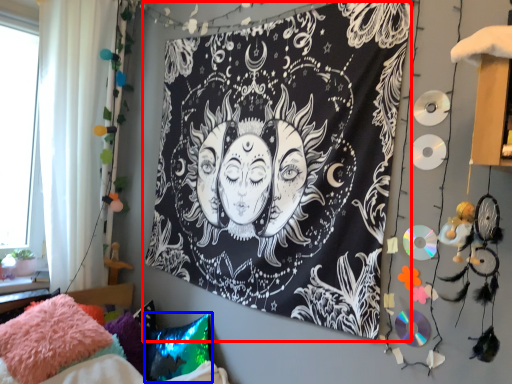
Question: Among these objects, which one is nearest to the camera, bulletin board (highlighted by a red box) or pillow (highlighted by a blue box)?

Choices:
 (A) bulletin board
 (B) pillow

Answer: (A)